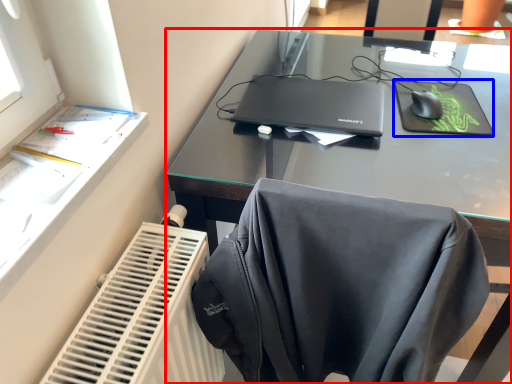
Question: Among these objects, which one is farthest to the camera, desk (highlighted by a red box) or mousepad (highlighted by a blue box)?

Choices:
 (A) desk
 (B) mousepad

Answer: (B)